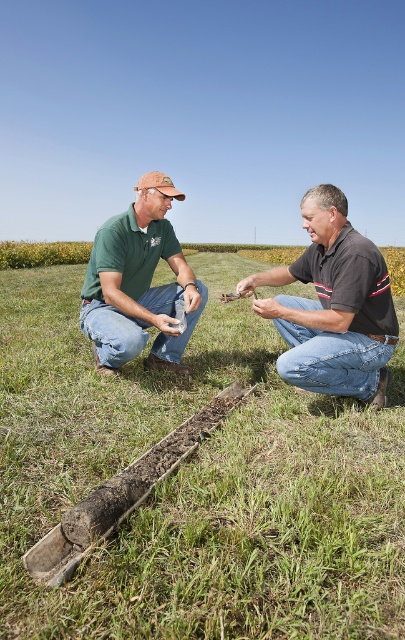
Question: Is green grass at center closer to the viewer compared to black matte shirt at center?

Choices:
 (A) yes
 (B) no

Answer: (A)

Question: Which point is farther to the camera?

Choices:
 (A) green grass at center
 (B) black matte shirt at center

Answer: (B)

Question: Which point is farther to the camera?

Choices:
 (A) (49, 637)
 (B) (179, 282)

Answer: (B)

Question: Estimate the real-world distances between objects in this image. Which object is closer to the green grass at center?

Choices:
 (A) black matte shirt at center
 (B) green matte shirt at center

Answer: (B)

Question: Does green grass at center have a smaller size compared to black matte shirt at center?

Choices:
 (A) yes
 (B) no

Answer: (B)

Question: Is green grass at center positioned before black matte shirt at center?

Choices:
 (A) yes
 (B) no

Answer: (A)